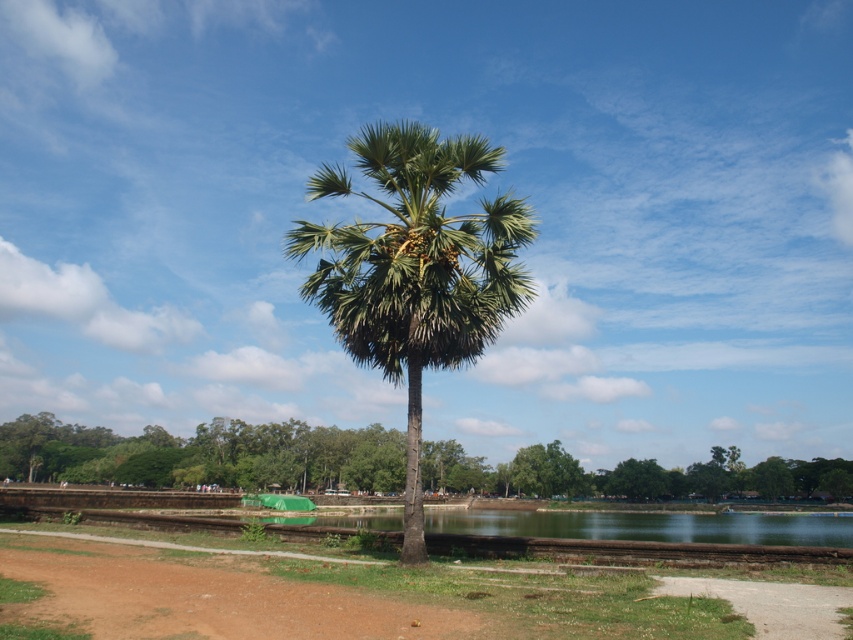
Looking at this image, is green leafy tree at center further to the viewer compared to brown dirt track at lower left?

That is True.

Which is below, green leafy tree at center or brown dirt track at lower left?

green leafy tree at center

Find the location of a particular element. Image resolution: width=853 pixels, height=640 pixels. green leafy tree at center is located at coordinates (206, 456).

Can you confirm if green leafy palm tree at center is positioned above brown dirt track at lower left?

Indeed, green leafy palm tree at center is positioned over brown dirt track at lower left.

What do you see at coordinates (415, 268) in the screenshot? The width and height of the screenshot is (853, 640). I see `green leafy palm tree at center` at bounding box center [415, 268].

Image resolution: width=853 pixels, height=640 pixels. Find the location of `green leafy palm tree at center`. green leafy palm tree at center is located at coordinates (415, 268).

Does green leafy palm tree at center have a smaller size compared to green leafy tree at center?

Yes, green leafy palm tree at center is smaller than green leafy tree at center.

Can you confirm if green leafy palm tree at center is positioned to the left of green leafy tree at center?

No, green leafy palm tree at center is not to the left of green leafy tree at center.

The image size is (853, 640). What do you see at coordinates (415, 268) in the screenshot?
I see `green leafy palm tree at center` at bounding box center [415, 268].

Image resolution: width=853 pixels, height=640 pixels. I want to click on green leafy palm tree at center, so click(415, 268).